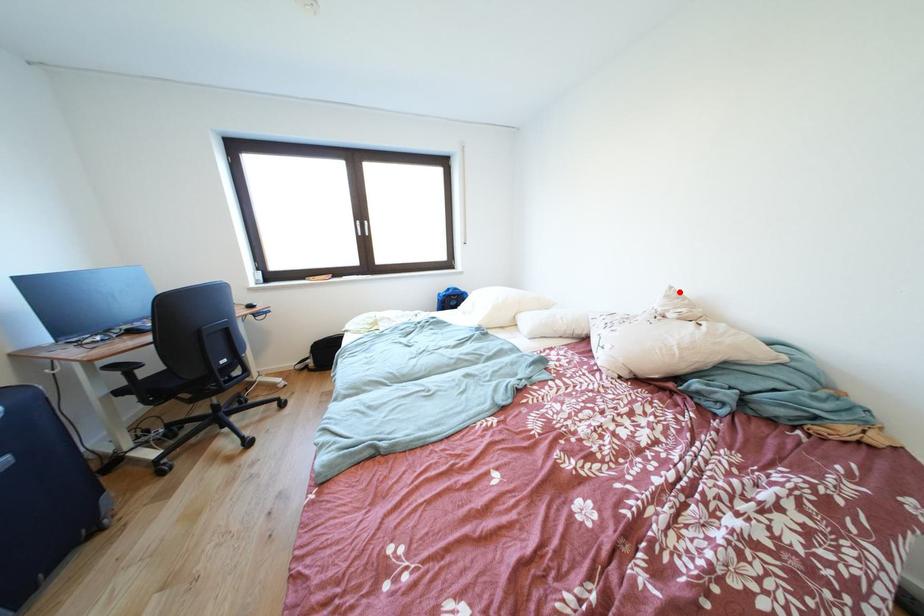
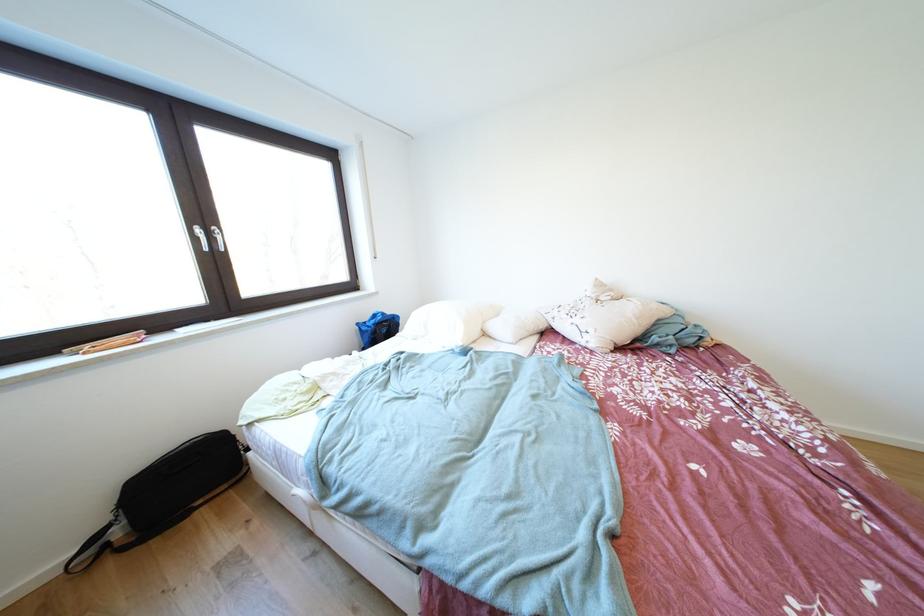
In the second image, find the point that corresponds to the highlighted location in the first image.

(604, 284)